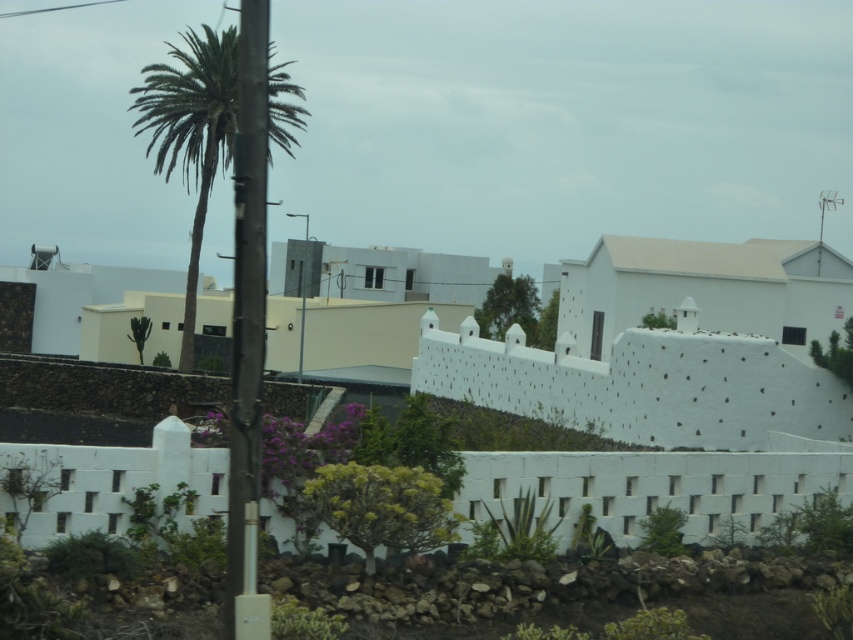
Who is more forward, (250,208) or (190,288)?

Point (250,208)

Which is more to the left, metallic pole at left or green leafy palm at upper left?

Positioned to the left is green leafy palm at upper left.

Describe the element at coordinates (247, 307) in the screenshot. The image size is (853, 640). I see `metallic pole at left` at that location.

Locate an element on the screen. The width and height of the screenshot is (853, 640). metallic pole at left is located at coordinates (247, 307).

Is point (718, 476) farther from camera compared to point (250, 451)?

Yes, point (718, 476) is farther from viewer.

Does white concrete wall at center have a lesser width compared to metallic pole at left?

No, white concrete wall at center is not thinner than metallic pole at left.

Is point (767, 500) positioned behind point (248, 188)?

That is True.

You are a GUI agent. You are given a task and a screenshot of the screen. Output one action in this format:
    pyautogui.click(x=<x>, y=<y>)
    Task: Click on the white concrete wall at center
    
    Given the screenshot: What is the action you would take?
    pyautogui.click(x=659, y=484)

Can you confirm if white concrete wall at center is smaller than green leafy palm at upper left?

Correct, white concrete wall at center occupies less space than green leafy palm at upper left.

The height and width of the screenshot is (640, 853). I want to click on white concrete wall at center, so click(x=659, y=484).